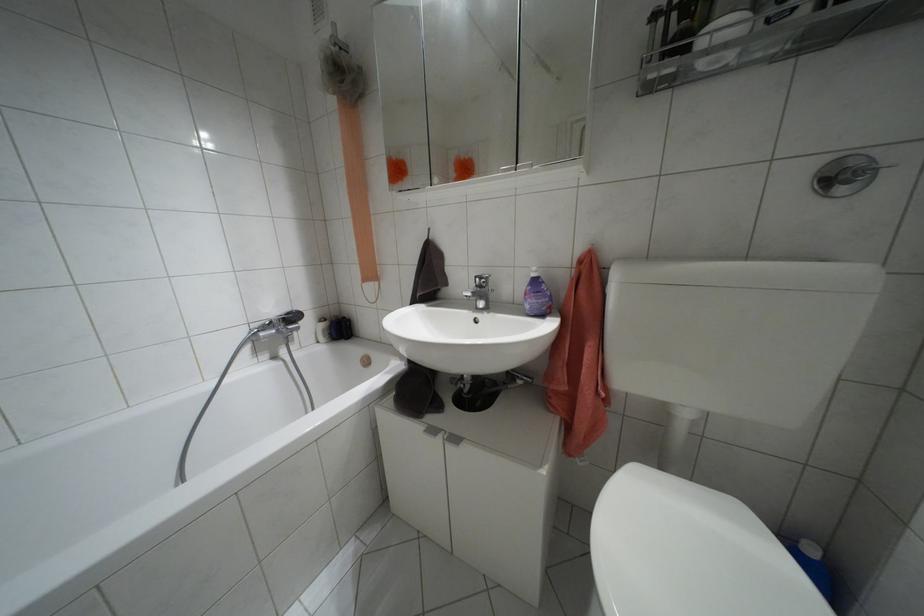
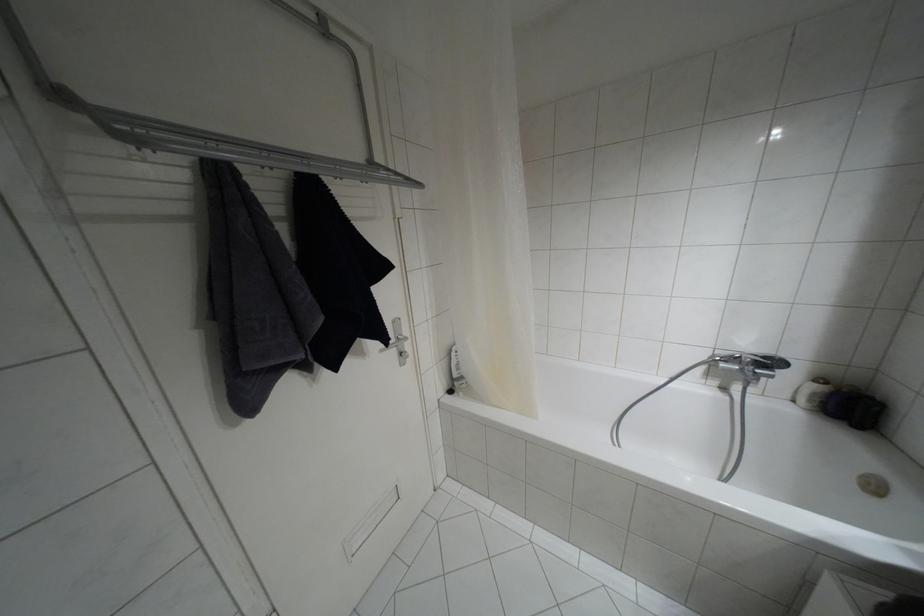
Where in the second image is the point corresponding to point 321,318 from the first image?

(820, 379)